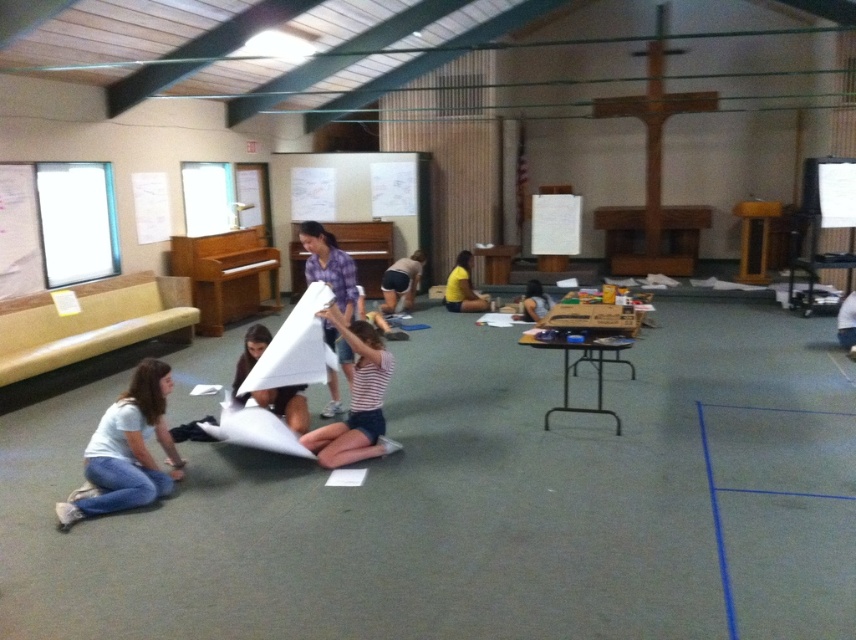
Does striped fabric shirt at center appear over yellow matte shirt at center?

No, striped fabric shirt at center is not above yellow matte shirt at center.

Is point (330, 445) in front of point (462, 280)?

Yes, point (330, 445) is closer to viewer.

Is point (325, 451) closer to camera compared to point (480, 300)?

Yes.

What are the coordinates of `striped fabric shirt at center` in the screenshot? It's located at (355, 400).

Does yellow matte shirt at center come behind matte white paper airplane at center?

Yes, it is behind matte white paper airplane at center.

Between yellow matte shirt at center and matte white paper airplane at center, which one appears on the left side from the viewer's perspective?

Positioned to the left is yellow matte shirt at center.

The height and width of the screenshot is (640, 856). Describe the element at coordinates (462, 288) in the screenshot. I see `yellow matte shirt at center` at that location.

Find the location of `yellow matte shirt at center`. yellow matte shirt at center is located at coordinates (462, 288).

Which is behind, point (333, 451) or point (290, 401)?

The point (290, 401) is behind.

Is striped fabric shirt at center taller than white paper at center?

Indeed, striped fabric shirt at center has a greater height compared to white paper at center.

The height and width of the screenshot is (640, 856). What do you see at coordinates (355, 400) in the screenshot?
I see `striped fabric shirt at center` at bounding box center [355, 400].

At what (x,y) coordinates should I click in order to perform the action: click on striped fabric shirt at center. Please return your answer as a coordinate pair (x, y). The height and width of the screenshot is (640, 856). Looking at the image, I should click on (355, 400).